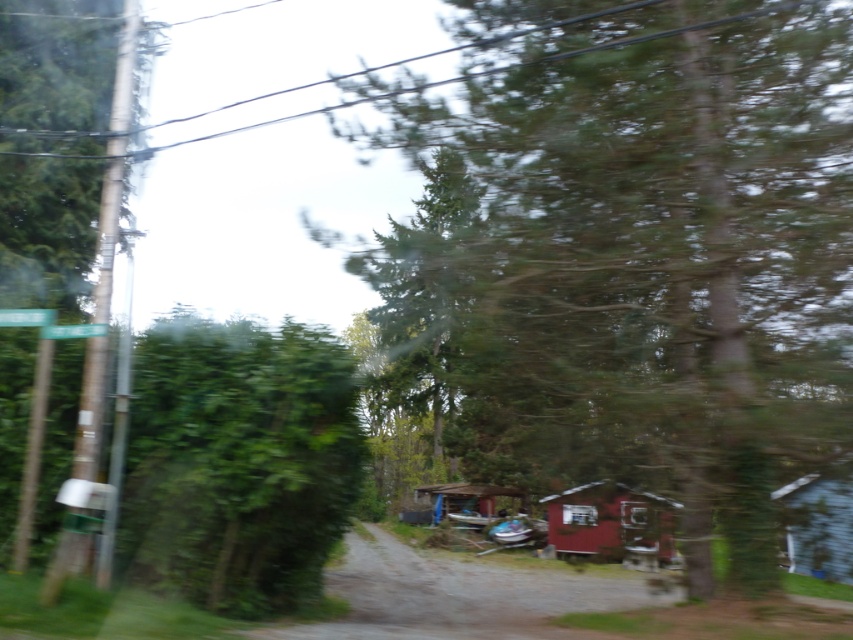
Is point (332, 506) closer to camera compared to point (567, 522)?

Yes, it is.

Between green leafy tree at left and clear glass car window at center, which one is positioned lower?

clear glass car window at center is lower down.

Does point (293, 486) lie in front of point (566, 515)?

Yes, it is.

You are a GUI agent. You are given a task and a screenshot of the screen. Output one action in this format:
    pyautogui.click(x=<x>, y=<y>)
    Task: Click on the green leafy tree at left
    Image resolution: width=853 pixels, height=640 pixels.
    Given the screenshot: What is the action you would take?
    pyautogui.click(x=239, y=461)

Who is higher up, brown rough wooden pole at left or clear glass car window at center?

Positioned higher is brown rough wooden pole at left.

Between brown rough wooden pole at left and clear glass car window at center, which one appears on the left side from the viewer's perspective?

brown rough wooden pole at left is more to the left.

Which is behind, point (24, 67) or point (595, 520)?

Positioned behind is point (24, 67).

Where is `brown rough wooden pole at left`? brown rough wooden pole at left is located at coordinates (49, 220).

Is wooden cabin at center to the left of clear glass car window at center from the viewer's perspective?

Correct, you'll find wooden cabin at center to the left of clear glass car window at center.

Who is positioned more to the left, wooden cabin at center or clear glass car window at center?

wooden cabin at center

This screenshot has width=853, height=640. Find the location of `wooden cabin at center`. wooden cabin at center is located at coordinates (467, 500).